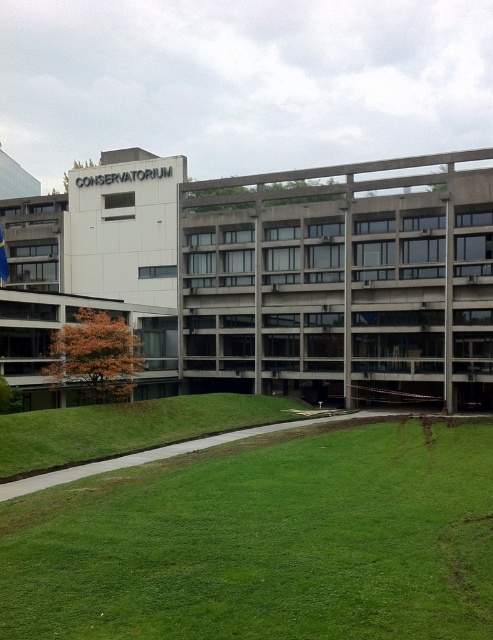
Is green grass at lower center to the right of concrete building at center from the viewer's perspective?

No, green grass at lower center is not to the right of concrete building at center.

This screenshot has width=493, height=640. What do you see at coordinates (265, 541) in the screenshot?
I see `green grass at lower center` at bounding box center [265, 541].

Find the location of a particular element. This screenshot has width=493, height=640. green grass at lower center is located at coordinates (265, 541).